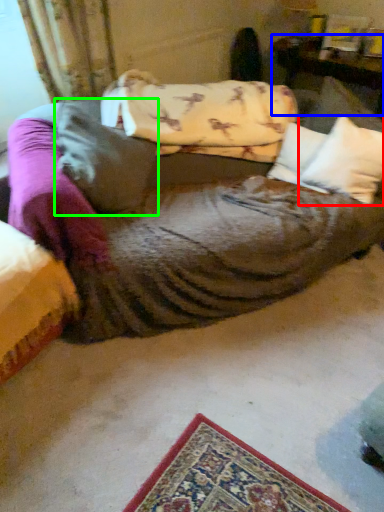
Question: Estimate the real-world distances between objects in this image. Which object is closer to pillow (highlighted by a red box), furniture (highlighted by a blue box) or pillow (highlighted by a green box)?

Choices:
 (A) furniture
 (B) pillow

Answer: (A)